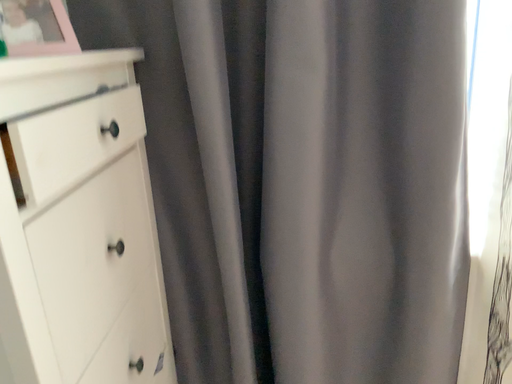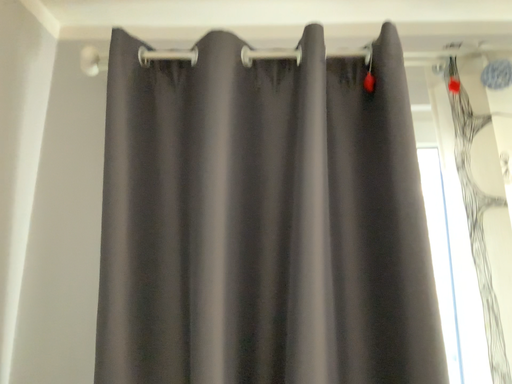
Question: How did the camera likely rotate when shooting the video?

Choices:
 (A) rotated downward
 (B) rotated upward

Answer: (B)